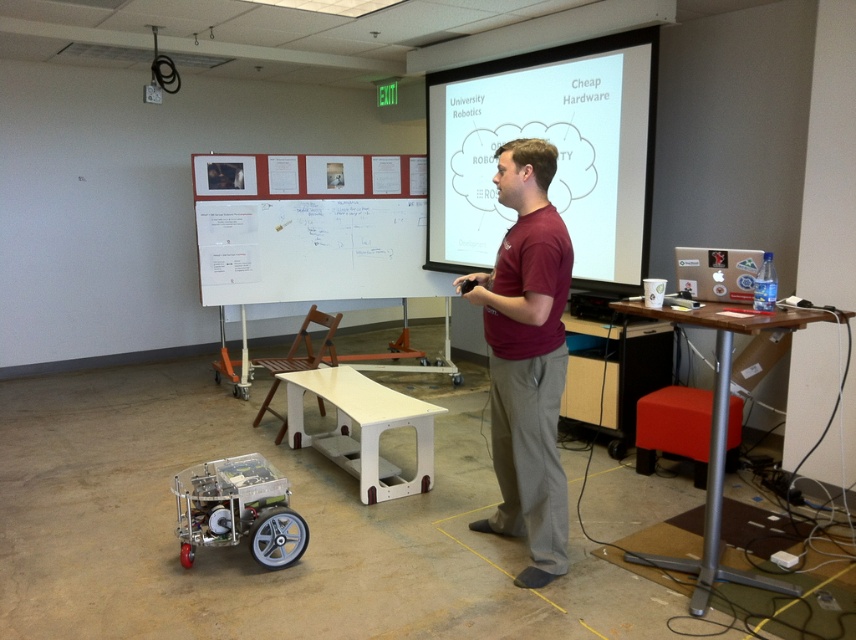
Between point (450, 264) and point (489, 337), which one is positioned behind?

Positioned behind is point (450, 264).

Between white matte projection screen at upper center and maroon fabric shirt at center, which one has more height?

white matte projection screen at upper center is taller.

Describe the element at coordinates (556, 147) in the screenshot. The height and width of the screenshot is (640, 856). I see `white matte projection screen at upper center` at that location.

Identify the location of white matte projection screen at upper center. (556, 147).

Is white matte table at center taller than wooden table at right?

No.

Between white matte table at center and wooden table at right, which one appears on the left side from the viewer's perspective?

white matte table at center

Identify the location of white matte table at center. Image resolution: width=856 pixels, height=640 pixels. (361, 428).

Who is shorter, white matte projection screen at upper center or wooden table at right?

wooden table at right

Which is behind, point (443, 260) or point (732, 328)?

Point (443, 260)

Which is in front, point (602, 144) or point (722, 307)?

Point (722, 307) is in front.

This screenshot has height=640, width=856. I want to click on white matte projection screen at upper center, so click(x=556, y=147).